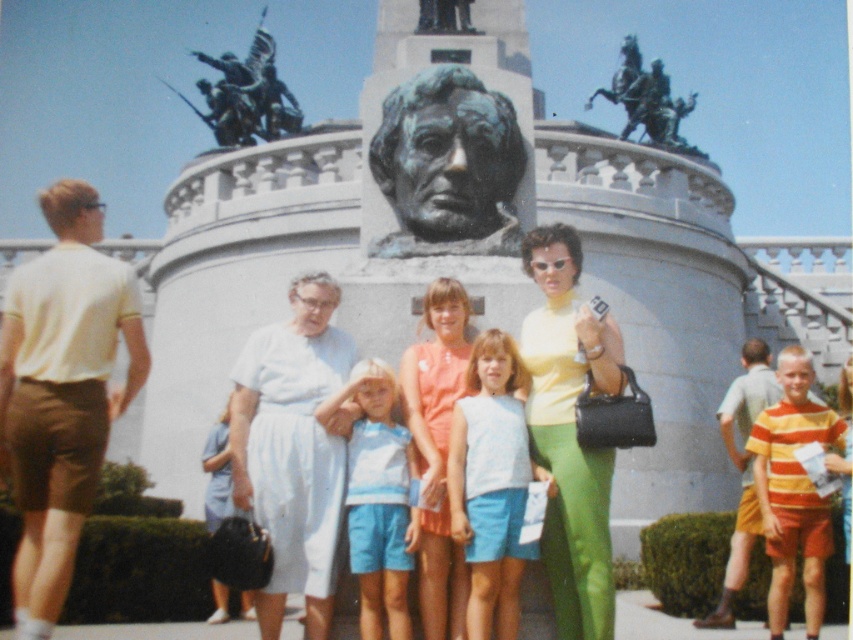
Question: Is yellow matte blouse at center further to the viewer compared to bronze statue at upper left?

Choices:
 (A) no
 (B) yes

Answer: (A)

Question: Which object is positioned closest to the white cotton dress at center?

Choices:
 (A) light blue fabric shorts at center
 (B) matte white dress at center

Answer: (B)

Question: Is light blue denim shorts at center wider than matte orange dress at center?

Choices:
 (A) yes
 (B) no

Answer: (A)

Question: Which point is closer to the camera taking this photo?

Choices:
 (A) (561, 301)
 (B) (434, 419)
 (C) (614, 364)

Answer: (C)

Question: Estimate the real-world distances between objects in this image. Which object is farther from the light blue denim shorts at center?

Choices:
 (A) white cotton dress at center
 (B) matte white dress at center
 (C) yellow matte blouse at center

Answer: (C)

Question: Is bronze statue at center smaller than bronze statue at upper left?

Choices:
 (A) no
 (B) yes

Answer: (B)